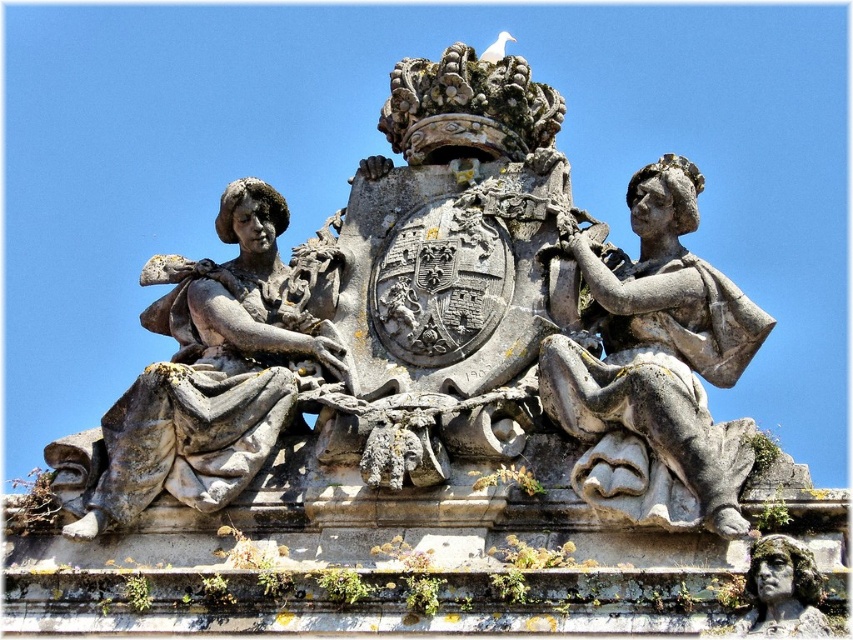
Which is above, gray stone sculpture at center or stone statue at left?

Positioned higher is gray stone sculpture at center.

Is the position of gray stone sculpture at center less distant than that of stone statue at left?

That is True.

Who is more distant from viewer, (142,436) or (267,193)?

Positioned behind is point (267,193).

Find the location of a particular element. gray stone sculpture at center is located at coordinates (440, 326).

Who is higher up, gray stone sculpture at center or gray stone statue at center?

gray stone sculpture at center is higher up.

This screenshot has width=853, height=640. Describe the element at coordinates (440, 326) in the screenshot. I see `gray stone sculpture at center` at that location.

Is point (247, 483) farther from camera compared to point (643, 184)?

No, it is not.

Identify the location of gray stone sculpture at center. Image resolution: width=853 pixels, height=640 pixels. (440, 326).

Is point (589, 380) more distant than point (228, 403)?

That is False.

Which is in front, point (677, 442) or point (297, 316)?

Point (677, 442) is in front.

Between point (614, 336) and point (194, 285), which one is positioned in front?

Positioned in front is point (614, 336).

I want to click on gray stone statue at center, so click(654, 368).